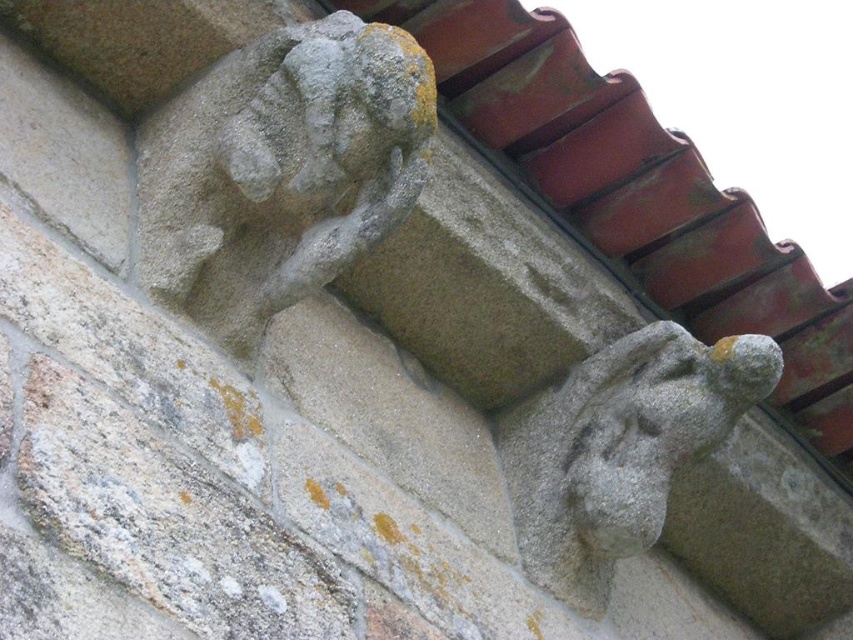
You are a construction worker needing to place a 2.5 meter long wooden beam between the gray stone gargoyle at upper left and the gray stone gargoyle at lower right. Based on the scene, will the beam fit between them?

The distance between the gray stone gargoyle at upper left and the gray stone gargoyle at lower right is 2.03 meters, which is shorter than the 2.5 meter beam. Therefore, the beam will not fit between them.

You are an architect analyzing the symmetry of the stone carvings. Given that both gray stone gargoyle at upper left and gray stone gargoyle at lower right are part of a symmetrical design, which one appears larger in the image?

The gray stone gargoyle at upper left appears larger than the gray stone gargoyle at lower right, which might indicate intentional asymmetry in the design or perspective differences due to their positioning.